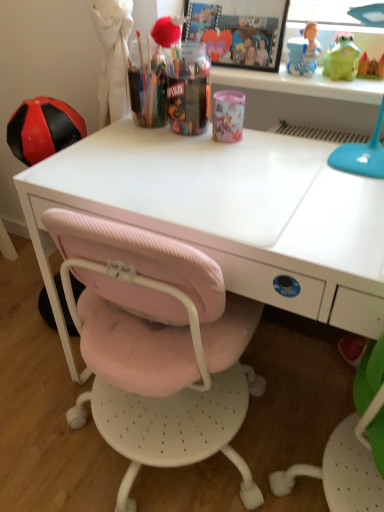
The image size is (384, 512). I want to click on vacant space to the right of pink glossy cup at center, the 1th stationery positioned from the right, so click(284, 145).